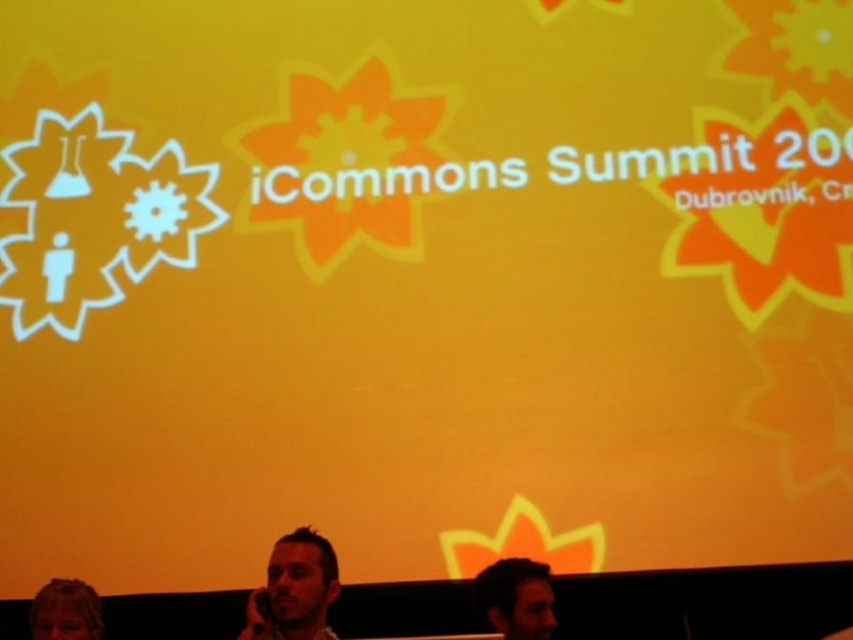
Question: Which object is positioned farthest from the dark brown hair at lower right?

Choices:
 (A) blonde hair at lower left
 (B) smooth brown hair at lower left

Answer: (A)

Question: Among these objects, which one is nearest to the camera?

Choices:
 (A) blonde hair at lower left
 (B) smooth brown hair at lower left
 (C) dark brown hair at lower right

Answer: (C)

Question: Among these objects, which one is nearest to the camera?

Choices:
 (A) smooth brown hair at lower left
 (B) blonde hair at lower left

Answer: (B)

Question: Can you confirm if smooth brown hair at lower left is positioned above blonde hair at lower left?

Choices:
 (A) no
 (B) yes

Answer: (B)

Question: Is smooth brown hair at lower left above dark brown hair at lower right?

Choices:
 (A) yes
 (B) no

Answer: (B)

Question: Is the position of dark brown hair at lower right more distant than that of blonde hair at lower left?

Choices:
 (A) no
 (B) yes

Answer: (A)